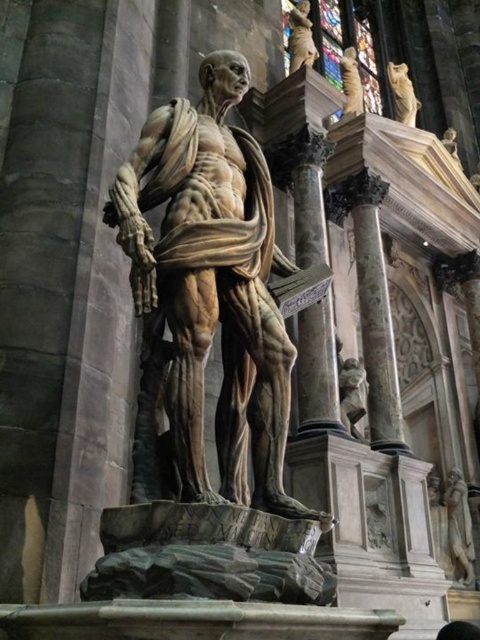
The width and height of the screenshot is (480, 640). What do you see at coordinates (208, 294) in the screenshot?
I see `polished marble statue at center` at bounding box center [208, 294].

Between point (253, 352) and point (325, 74), which one is positioned in front?

Positioned in front is point (253, 352).

Image resolution: width=480 pixels, height=640 pixels. Find the location of `polished marble statue at center`. polished marble statue at center is located at coordinates (208, 294).

Measure the distance from polished bronze statue at right to bronze statue at upper right.

49.91 meters

Consider the image. Is polished bronze statue at right closer to camera compared to bronze statue at upper right?

No.

Is point (468, 520) farther from viewer compared to point (291, 61)?

Yes, point (468, 520) is behind point (291, 61).

This screenshot has height=640, width=480. Identify the location of polished bronze statue at right. (458, 529).

Can you confirm if bronze statue at upper right is positioned below golden stone cat at upper right?

No.

Is point (311, 51) less distant than point (407, 120)?

Yes, point (311, 51) is closer to viewer.

What are the coordinates of `bronze statue at upper right` in the screenshot? It's located at (300, 36).